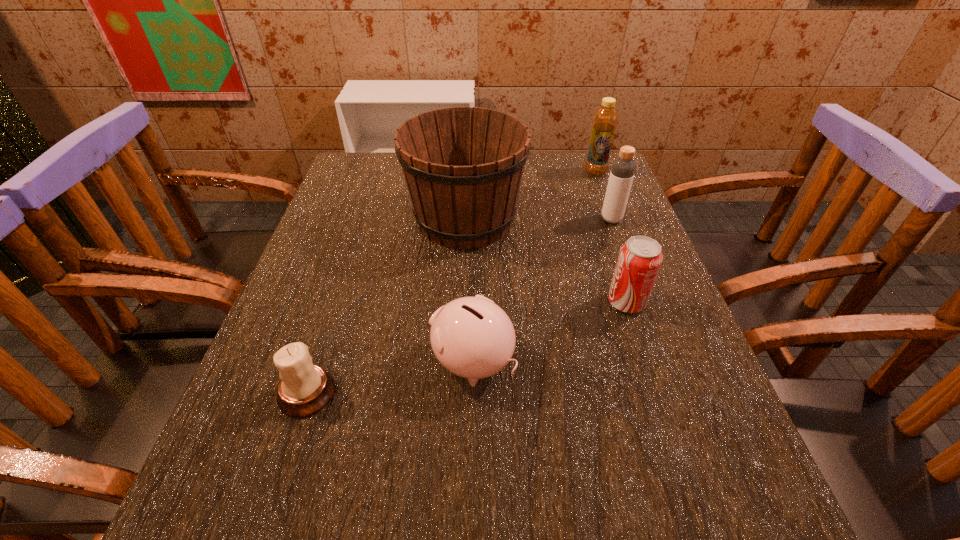
At what (x,y) coordinates should I click in order to perform the action: click on vacant region at the near edge. Please return your answer as a coordinate pair (x, y). This screenshot has height=540, width=960. Looking at the image, I should click on (308, 521).

In the image, there is a desktop. What are the coordinates of `vacant space at the left edge` in the screenshot? It's located at (324, 246).

Where is `vacant space at the right edge`? vacant space at the right edge is located at coordinates (660, 292).

This screenshot has width=960, height=540. In order to click on free region at the far left corner in this screenshot , I will do `click(359, 167)`.

The image size is (960, 540). In the image, there is a desktop. What are the coordinates of `vacant area at the near left corner` in the screenshot? It's located at (192, 526).

I want to click on free space at the far right corner of the desktop, so click(609, 174).

The width and height of the screenshot is (960, 540). In the image, there is a desktop. What are the coordinates of `vacant space at the near right corner` in the screenshot? It's located at [770, 510].

This screenshot has width=960, height=540. I want to click on vacant space that's between the piggy bank and the nearer bottle, so click(541, 291).

In order to click on unoccupied position between the farthest object and the wine bucket in this screenshot , I will do (530, 195).

You are a GUI agent. You are given a task and a screenshot of the screen. Output one action in this format:
    pyautogui.click(x=<x>, y=<y>)
    Task: Click on the vacant space that's between the piggy bank and the wine bucket
    Image resolution: width=960 pixels, height=540 pixels.
    Given the screenshot: What is the action you would take?
    pyautogui.click(x=468, y=291)